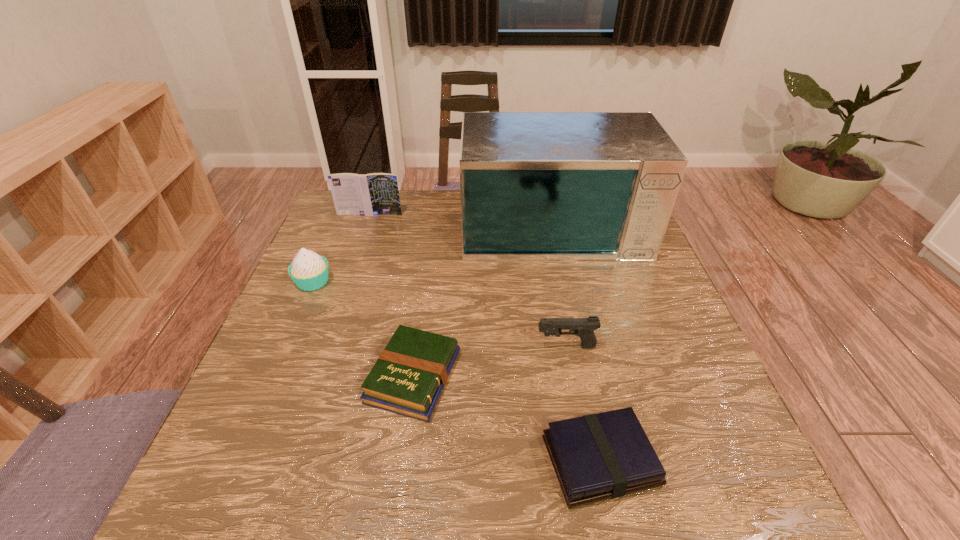
Identify the location of microwave oven. (535, 186).

Where is `the tallest book`? the tallest book is located at coordinates (372, 194).

Find the location of `the farthest book`. the farthest book is located at coordinates (372, 194).

What are the coordinates of `the fourth nearest object` in the screenshot? It's located at (309, 271).

You are a GUI agent. You are given a task and a screenshot of the screen. Output one action in this format:
    pyautogui.click(x=<x>, y=<y>)
    Task: Click on the fourth tallest object
    
    Given the screenshot: What is the action you would take?
    pyautogui.click(x=583, y=327)

Find the location of a particular element. the second book from right to left is located at coordinates (408, 378).

Where is `the rightmost book`? This screenshot has width=960, height=540. the rightmost book is located at coordinates point(596,457).

Locate an element on the screen. The image size is (960, 540). vacant space situated 0.170m on the front-facing side of the tallest object is located at coordinates (569, 304).

This screenshot has height=540, width=960. What are the coordinates of `vacant space positioned on the front cover of the farthest book` in the screenshot? It's located at (352, 265).

This screenshot has width=960, height=540. What are the coordinates of `vacant space located on the front of the cupcake` in the screenshot? It's located at (291, 334).